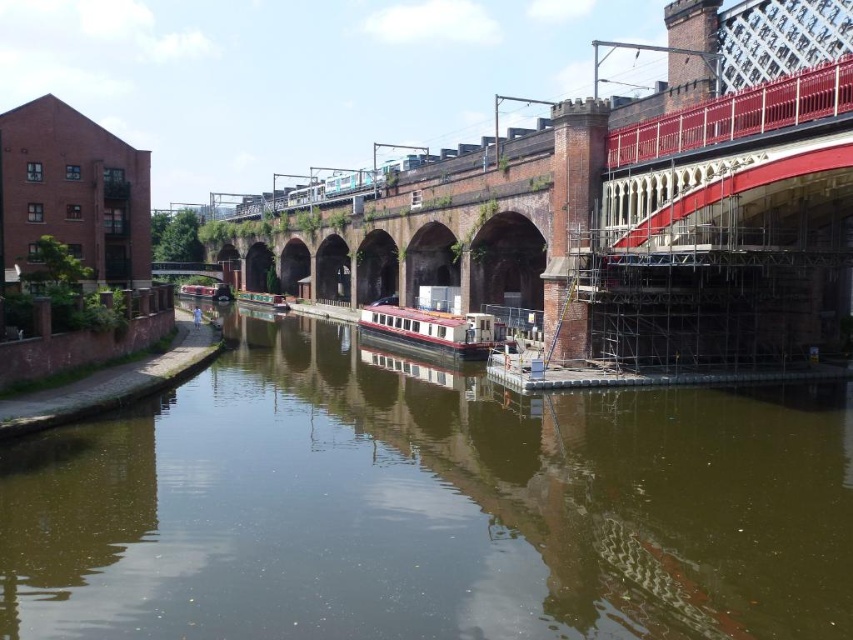
You are standing on the canal bank and want to cross to the other side. There is a brick red bridge at upper center and green reflective water at center. Which object is positioned to the right of the other?

The green reflective water at center is to the right of the brick red bridge at upper center.

You are a tourist standing on the railway bridge and want to take a photo of the canal. You notice the green reflective water at center and the matte red houseboat at center. Which object should you focus on first if you want to capture the reflection of the bridge in the water?

The green reflective water at center is to the right of the matte red houseboat at center. To capture the reflection of the bridge in the water, focus on the green reflective water at center since it is positioned where the bridge might be reflected.

You are standing at the point marked as point (x=428, y=508) in the canal scene. What surface are you currently standing on?

The point (x=428, y=508) is on green reflective water at center, so you are standing on the green reflective water at center.